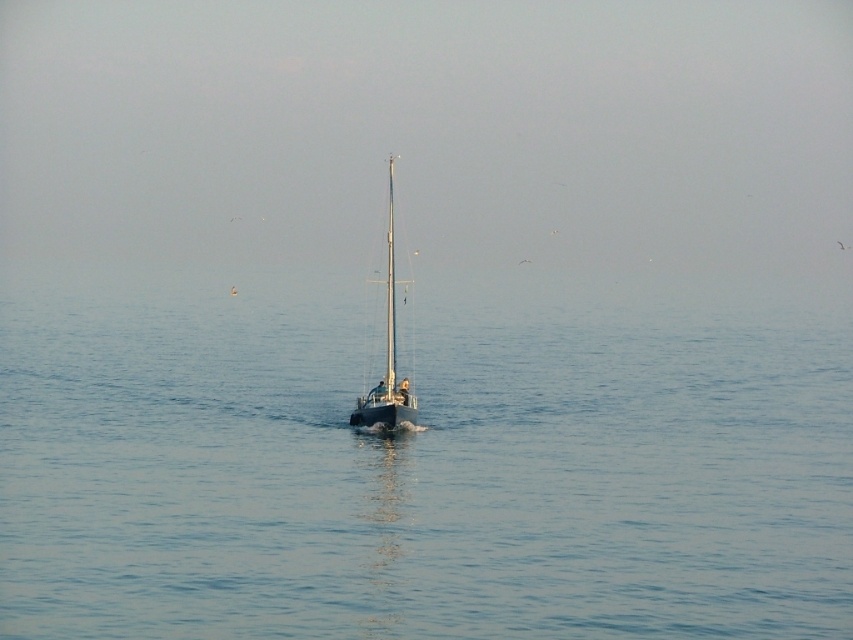
Question: Which object is the farthest from the shiny black sailboat at center?

Choices:
 (A) shiny silver mast at center
 (B) blue water at center

Answer: (B)

Question: Is blue water at center above shiny silver mast at center?

Choices:
 (A) yes
 (B) no

Answer: (B)

Question: Estimate the real-world distances between objects in this image. Which object is farther from the blue water at center?

Choices:
 (A) shiny silver mast at center
 (B) shiny black sailboat at center

Answer: (B)

Question: Considering the relative positions of blue water at center and shiny silver mast at center in the image provided, where is blue water at center located with respect to shiny silver mast at center?

Choices:
 (A) above
 (B) below

Answer: (B)

Question: From the image, what is the correct spatial relationship of blue water at center in relation to shiny black sailboat at center?

Choices:
 (A) left
 (B) right

Answer: (B)

Question: Which point is farther to the camera?

Choices:
 (A) shiny silver mast at center
 (B) blue water at center

Answer: (A)